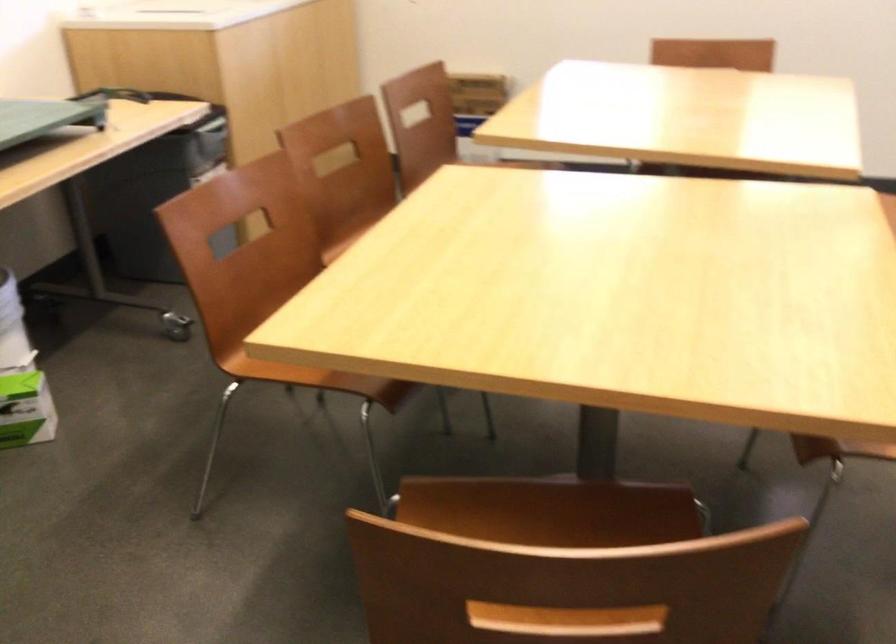
Question: Based on the continuous images, in which direction is the camera rotating? Reply with the corresponding letter.

Choices:
 (A) Left
 (B) Right
 (C) Up
 (D) Down

Answer: (B)